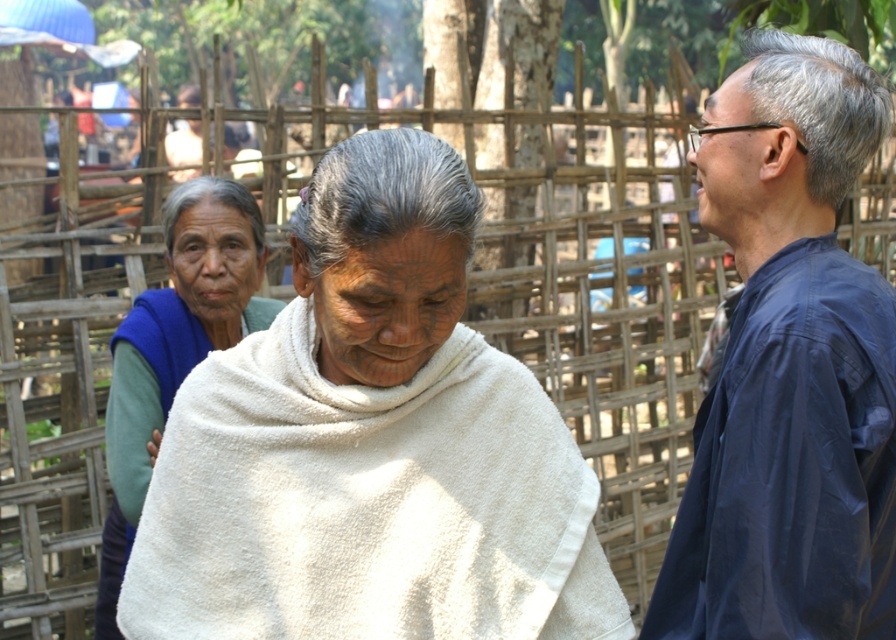
Is blue fabric shirt at right thinner than blue fleece vest at left?

Incorrect, blue fabric shirt at right's width is not less than blue fleece vest at left's.

Does point (825, 65) come farther from viewer compared to point (116, 342)?

No, it is in front of (116, 342).

You are a GUI agent. You are given a task and a screenshot of the screen. Output one action in this format:
    pyautogui.click(x=<x>, y=<y>)
    Task: Click on the blue fabric shirt at right
    The image size is (896, 640).
    Given the screenshot: What is the action you would take?
    pyautogui.click(x=789, y=368)

Locate an element on the screen. The image size is (896, 640). white soft cloth at center is located at coordinates (367, 502).

Does point (489, 376) lie in front of point (886, 401)?

No, (489, 376) is further to viewer.

I want to click on white soft cloth at center, so click(367, 502).

Is white soft cloth at center thinner than blue fleece vest at left?

No.

Does point (349, 536) come behind point (185, 260)?

No, (349, 536) is in front of (185, 260).

Find the location of a particular element. The width and height of the screenshot is (896, 640). white soft cloth at center is located at coordinates (367, 502).